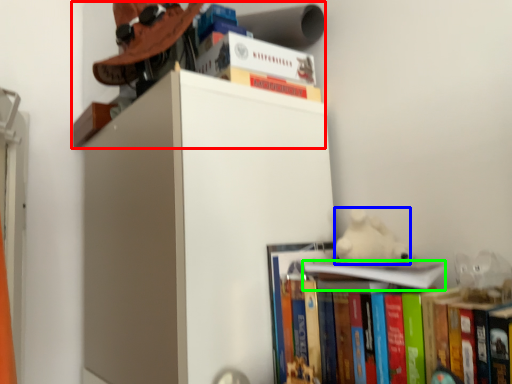
Question: Considering the real-world distances, which object is farthest from shelf (highlighted by a red box)? animal (highlighted by a blue box) or book (highlighted by a green box)?

Choices:
 (A) animal
 (B) book

Answer: (B)